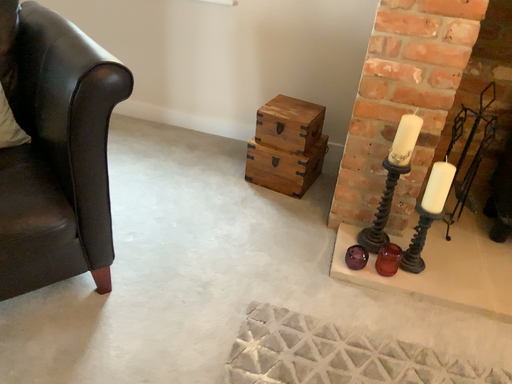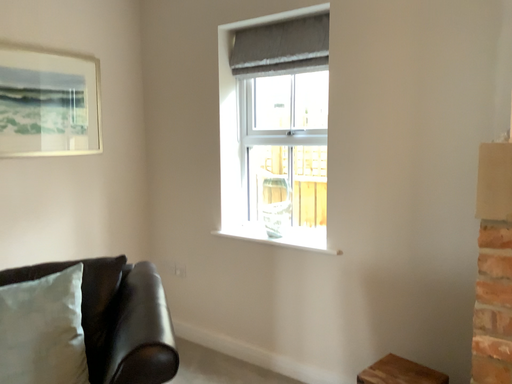
Question: How did the camera likely rotate when shooting the video?

Choices:
 (A) rotated upward
 (B) rotated downward

Answer: (A)